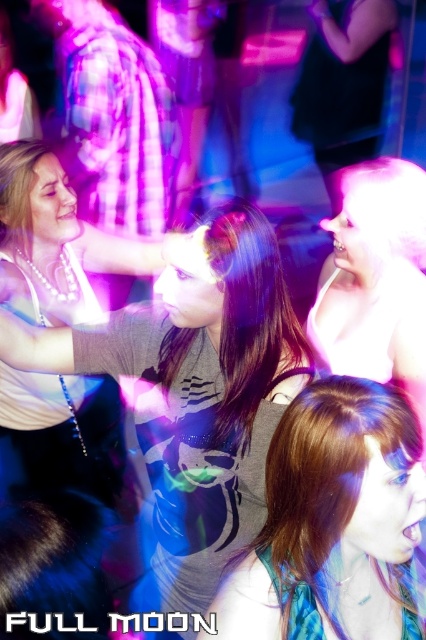
Question: Does matte gray shirt at center appear on the right side of shiny white hair at upper right?

Choices:
 (A) yes
 (B) no

Answer: (B)

Question: Estimate the real-world distances between objects in this image. Which object is farther from the shiny white hair at upper right?

Choices:
 (A) matte gray shirt at center
 (B) shiny brown hair at center

Answer: (B)

Question: Does matte gray shirt at center appear over shiny brown hair at center?

Choices:
 (A) no
 (B) yes

Answer: (B)

Question: Is matte gray shirt at center to the left of shiny brown hair at center from the viewer's perspective?

Choices:
 (A) yes
 (B) no

Answer: (A)

Question: Among these points, which one is farthest from the camera?

Choices:
 (A) (261, 465)
 (B) (351, 288)
 (C) (296, 465)

Answer: (B)

Question: Which object appears closest to the camera in this image?

Choices:
 (A) shiny brown hair at center
 (B) matte gray shirt at center

Answer: (A)